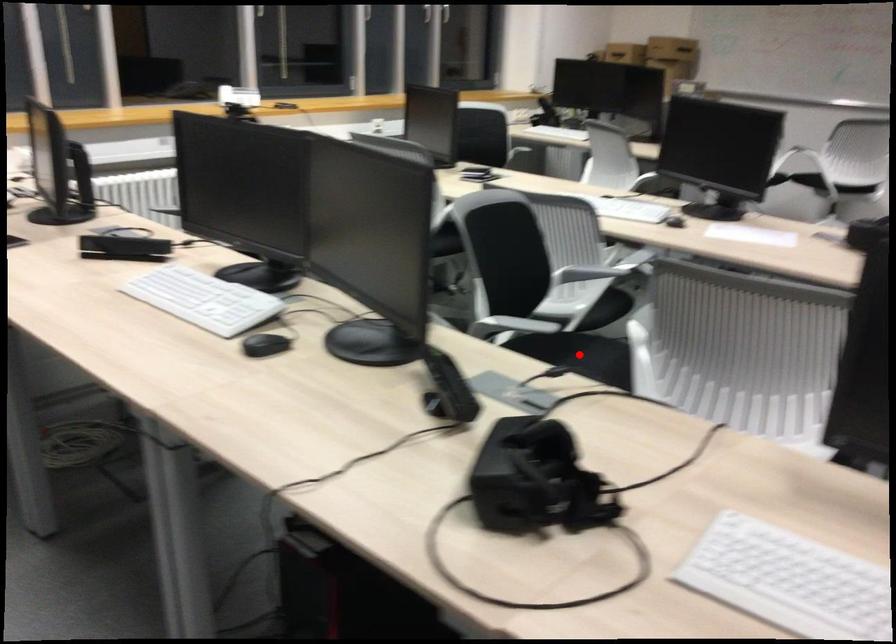
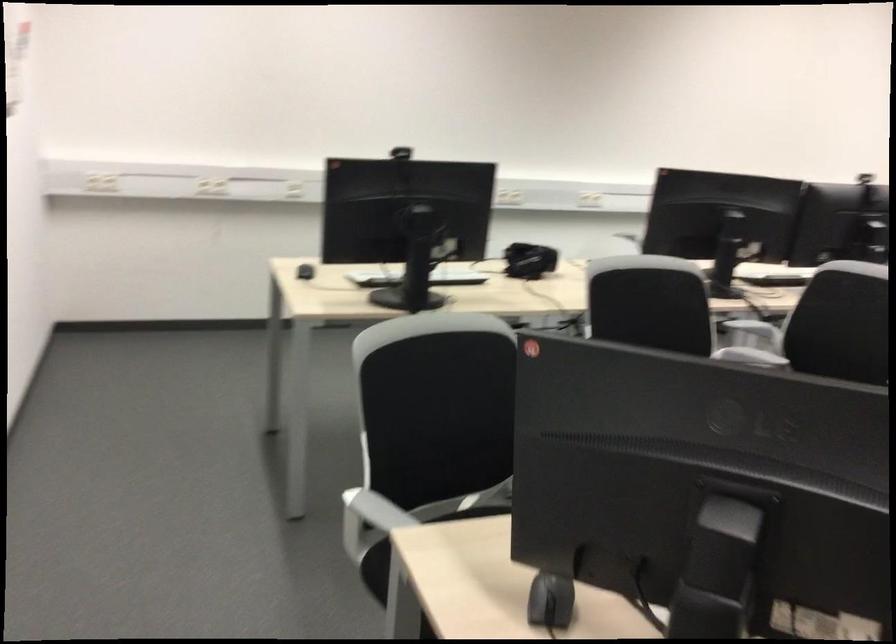
Question: I am providing you with two images of the same scene from different viewpoints. A red point is marked on the first image. At the location where the point appears in image 1, is it still visible in image 2?

Choices:
 (A) Yes
 (B) No

Answer: (B)